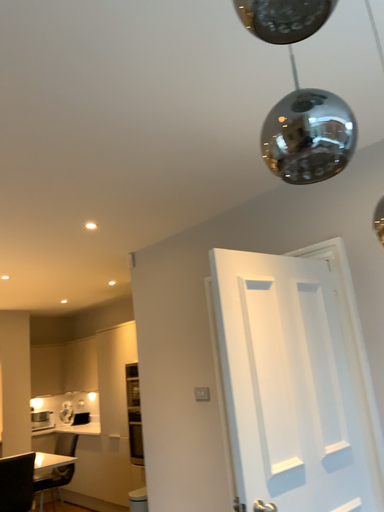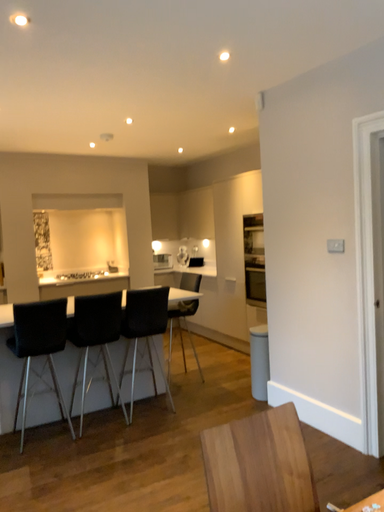
Question: How did the camera likely rotate when shooting the video?

Choices:
 (A) rotated downward
 (B) rotated upward

Answer: (A)